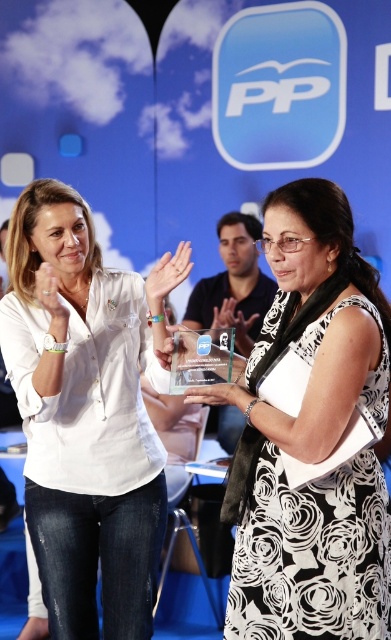
Looking at this image, you are a photographer at the event and need to capture a closeup of the matte white hand at center and the matte plastic award at center. Since the camera can only focus on one object at a time, which object should you focus on first to ensure the other is still in the frame?

You should focus on the matte plastic award at center first because the matte white hand at center is to the left of it, so by focusing on the award, the hand will still be within the frame.

You are a photographer at the event and need to ensure that both the white cotton shirt at center and the matte plastic award at center are visible in your shot. Given their sizes, which object should you focus on to frame both properly?

The white cotton shirt at center is wider than the matte plastic award at center, so focusing on the white cotton shirt at center will ensure both objects are framed properly since it takes up more space.